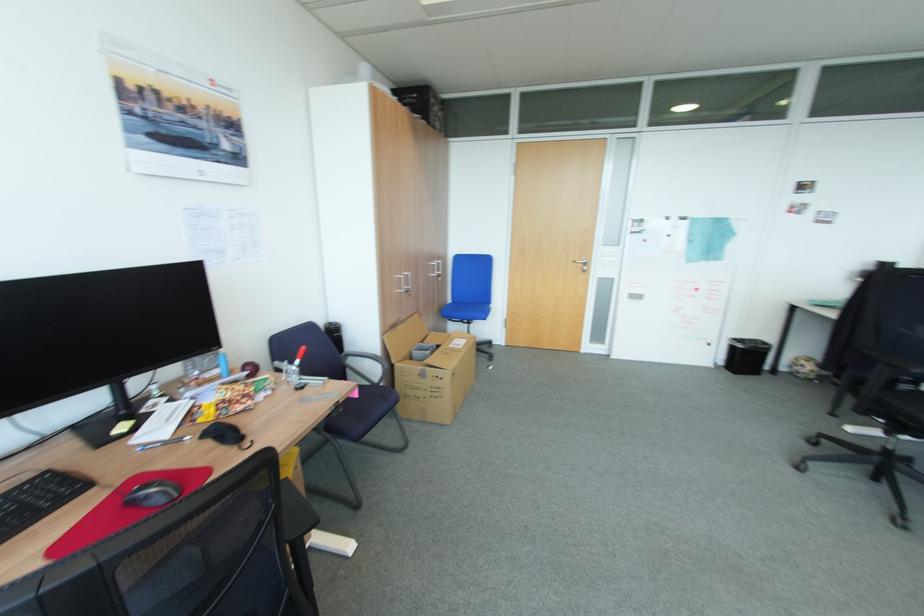
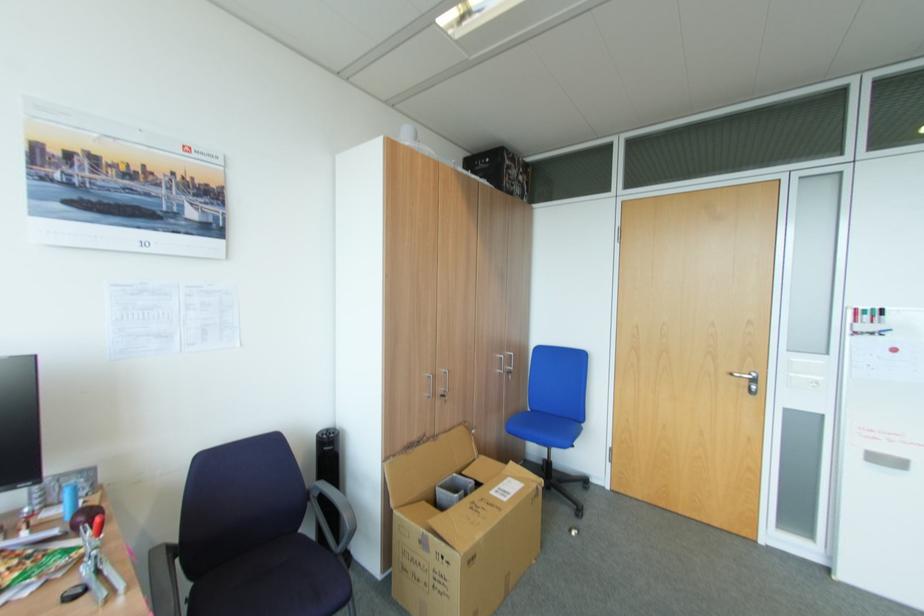
Where in the second image is the point corresponding to [448,317] from the first image?

(515, 431)